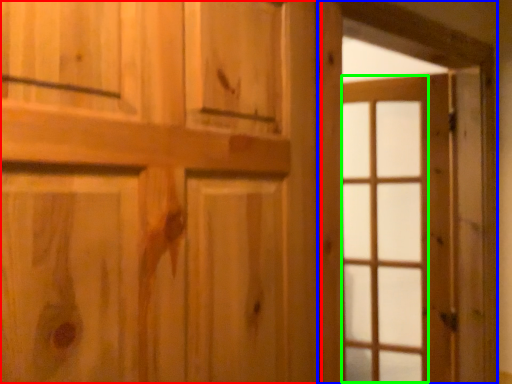
Question: Estimate the real-world distances between objects in this image. Which object is closer to door (highlighted by a red box), barn door (highlighted by a blue box) or glass door (highlighted by a green box)?

Choices:
 (A) barn door
 (B) glass door

Answer: (A)